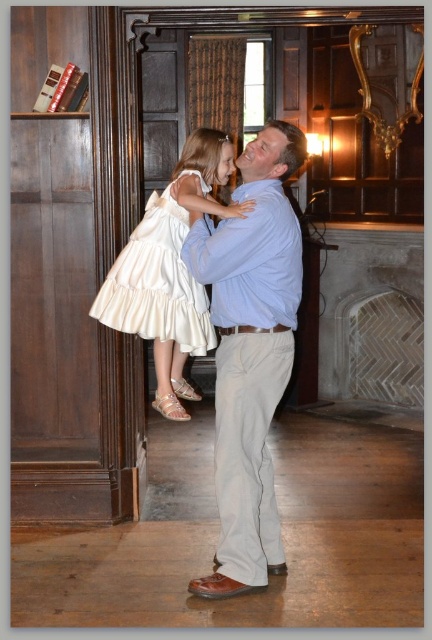
Please look at the coordinates provided in the image. The point at (250, 353) is located where?

The point at (250, 353) marks the light blue shirt at center.

You are standing in the room and want to reach the point marked at coordinates (x=149, y=310). If your walking speed is 1.2 meters per second, how long will it take you to reach that point?

The distance between you and the point marked at coordinates (x=149, y=310) is 3.40 meters. At a walking speed of 1.2 meters per second, it will take approximately 2.83 seconds to reach the point.

You are a photographer standing in the room and want to capture a clear photo of both the white satin dress at center and the ivory satin dress at center. Which dress should you focus on first to ensure both are in focus?

You should focus on the white satin dress at center first since it is closer to you than the ivory satin dress at center, so adjusting the focus from near to far will help both dresses be in focus.